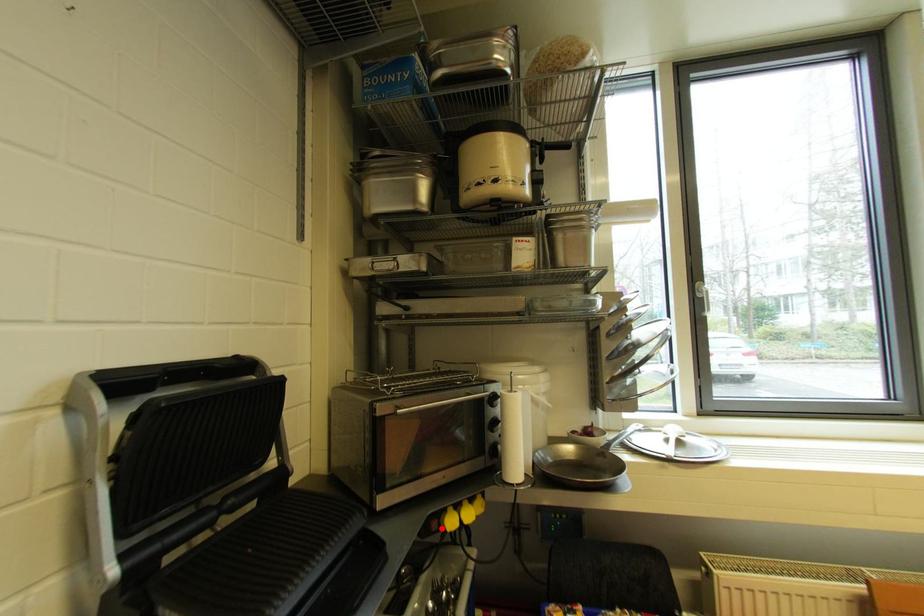
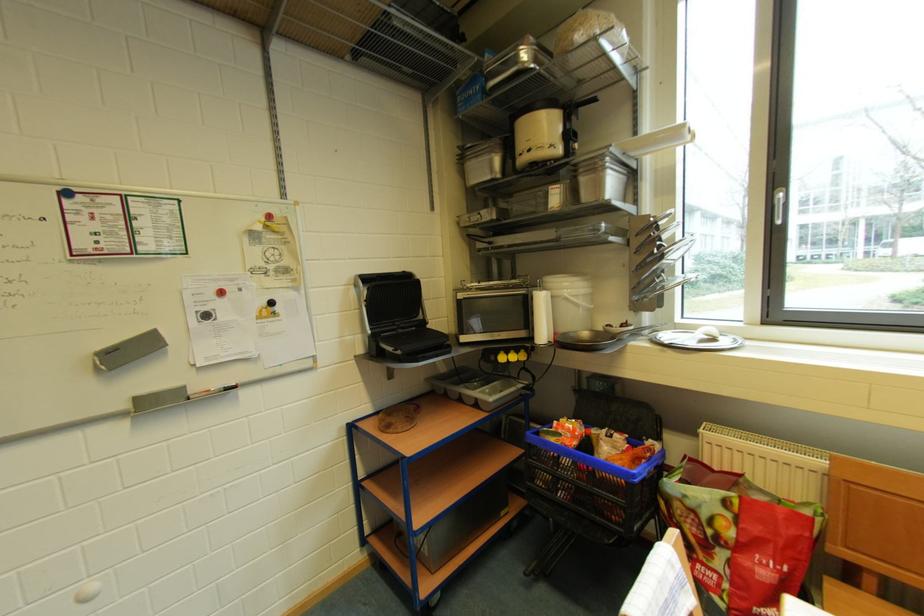
Question: I am providing you with two images of the same scene from different viewpoints. A red point is marked on the first image. Can you still see the location of the red point in image 2?

Choices:
 (A) Yes
 (B) No

Answer: (A)